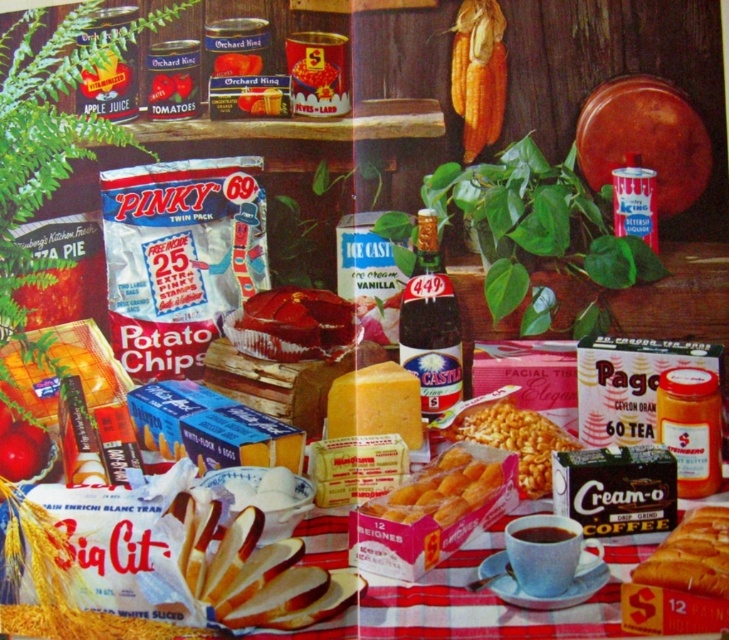
Does matte yellow macaroni at center have a smaller size compared to shiny red tomato at lower left?

No, matte yellow macaroni at center is not smaller than shiny red tomato at lower left.

Is point (521, 444) less distant than point (26, 440)?

No, (521, 444) is further to viewer.

Where is `matte yellow macaroni at center`? The image size is (729, 640). matte yellow macaroni at center is located at coordinates (515, 440).

How far apart are sliced white bread at center and matte yellow macaroni at center?

sliced white bread at center and matte yellow macaroni at center are 20.91 centimeters apart from each other.

Is sliced white bread at center above matte yellow macaroni at center?

Actually, sliced white bread at center is below matte yellow macaroni at center.

Locate an element on the screen. sliced white bread at center is located at coordinates (254, 572).

At what (x,y) coordinates should I click in order to perform the action: click on sliced white bread at center. Please return your answer as a coordinate pair (x, y). This screenshot has width=729, height=640. Looking at the image, I should click on (254, 572).

Which of these two, matte yellow macaroni at center or dark brown cardboard coffee at lower right, stands shorter?

dark brown cardboard coffee at lower right

Is matte yellow macaroni at center to the left of dark brown cardboard coffee at lower right from the viewer's perspective?

Yes, matte yellow macaroni at center is to the left of dark brown cardboard coffee at lower right.

The width and height of the screenshot is (729, 640). Describe the element at coordinates (515, 440) in the screenshot. I see `matte yellow macaroni at center` at that location.

Where is `matte yellow macaroni at center`? matte yellow macaroni at center is located at coordinates (515, 440).